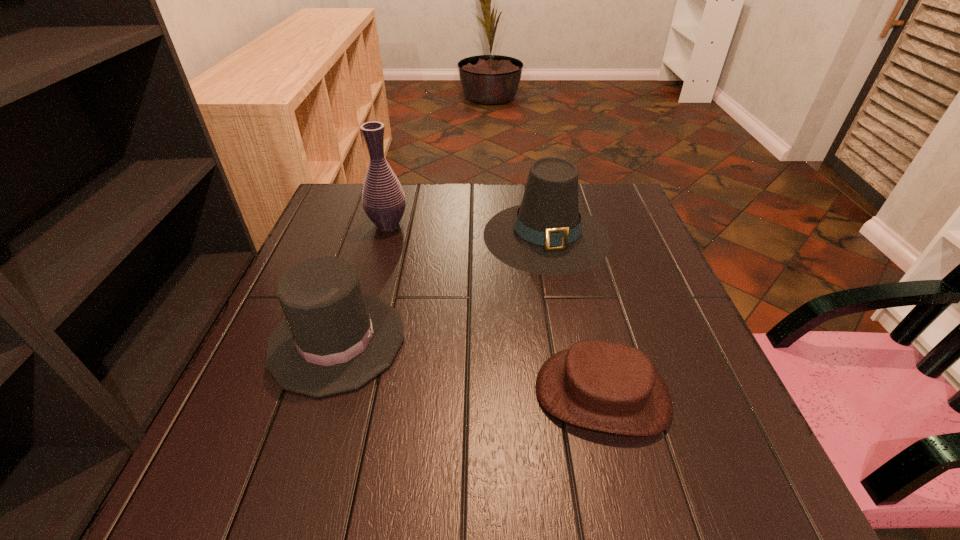
You are a GUI agent. You are given a task and a screenshot of the screen. Output one action in this format:
    pyautogui.click(x=<x>, y=<y>)
    Task: Click on the vacant space that satisfies the following two spatial constraints: 1. on the front-facing side of the farthest hat; 2. on the front of the second shortest object with the decoration
    Image resolution: width=960 pixels, height=540 pixels.
    Given the screenshot: What is the action you would take?
    pyautogui.click(x=566, y=341)

The height and width of the screenshot is (540, 960). In order to click on vacant space that satisfies the following two spatial constraints: 1. on the front-facing side of the farthest hat; 2. on the front of the second shortest hat with the decoration in this screenshot , I will do `click(566, 341)`.

Where is `blank space that satisfies the following two spatial constraints: 1. on the front of the leftmost hat with the decoration; 2. on the right side of the shortest hat`? Image resolution: width=960 pixels, height=540 pixels. blank space that satisfies the following two spatial constraints: 1. on the front of the leftmost hat with the decoration; 2. on the right side of the shortest hat is located at coordinates (320, 394).

Find the location of a particular element. The width and height of the screenshot is (960, 540). vacant space that satisfies the following two spatial constraints: 1. on the front of the leftmost hat with the decoration; 2. on the left side of the shortest hat is located at coordinates (320, 394).

Identify the location of free space that satisfies the following two spatial constraints: 1. on the back side of the shortest hat; 2. on the front of the second shortest hat with the decoration. The image size is (960, 540). (589, 341).